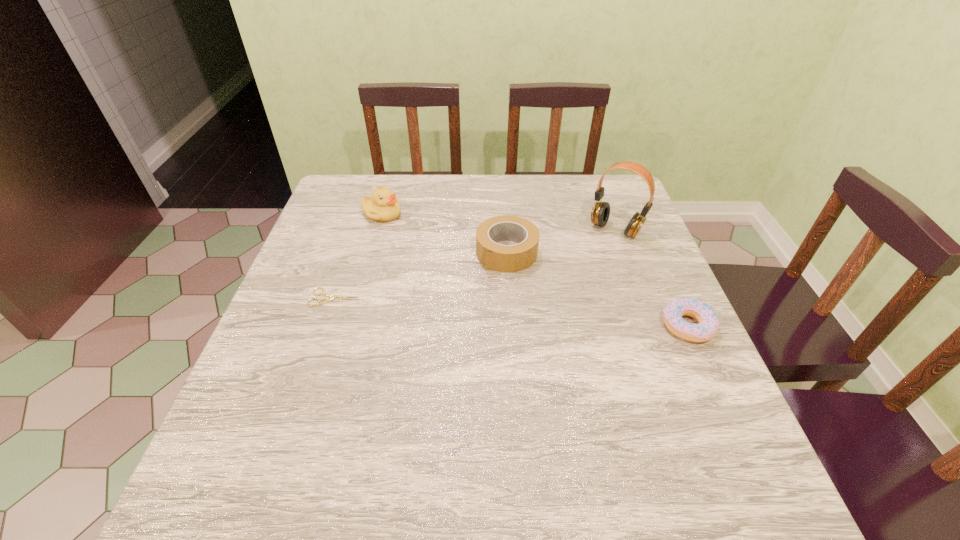
Where is `free space between the fourth shortest object and the shears`? Image resolution: width=960 pixels, height=540 pixels. free space between the fourth shortest object and the shears is located at coordinates (358, 256).

This screenshot has width=960, height=540. I want to click on empty location between the shears and the doughnut, so click(512, 312).

The width and height of the screenshot is (960, 540). In order to click on vacant space in between the tallest object and the nearest object in this screenshot , I will do `click(652, 278)`.

The height and width of the screenshot is (540, 960). Find the location of `vacant region between the shears and the headset`. vacant region between the shears and the headset is located at coordinates (475, 264).

Identify the location of object that is the second closest to the tallest object. This screenshot has width=960, height=540. (708, 321).

At what (x,y) coordinates should I click in order to perform the action: click on object that is the fourth closest to the duckling. Please return your answer as a coordinate pair (x, y). Image resolution: width=960 pixels, height=540 pixels. Looking at the image, I should click on (708, 321).

The height and width of the screenshot is (540, 960). I want to click on vacant space that satisfies the following two spatial constraints: 1. on the front side of the doughnut; 2. on the left side of the tallest object, so click(652, 327).

This screenshot has width=960, height=540. What are the coordinates of `free space that satisfies the following two spatial constraints: 1. on the front side of the doughnut; 2. on the left side of the duckling` in the screenshot? It's located at [x=350, y=327].

You are a GUI agent. You are given a task and a screenshot of the screen. Output one action in this format:
    pyautogui.click(x=<x>, y=<y>)
    Task: Click on the vacant space that satisfies the following two spatial constraints: 1. on the front side of the duckling; 2. on the left side of the doughnut
    Image resolution: width=960 pixels, height=540 pixels.
    Given the screenshot: What is the action you would take?
    pyautogui.click(x=350, y=327)